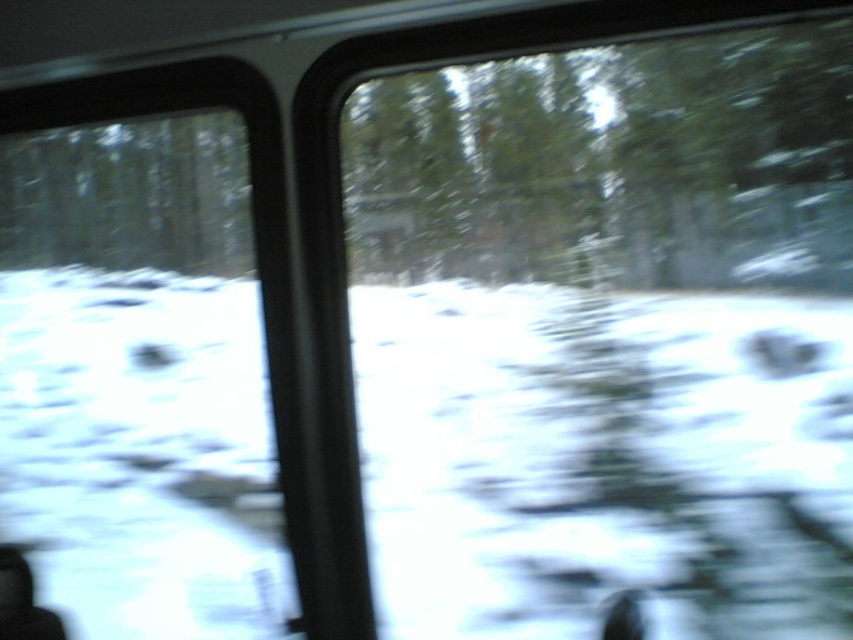
You are a passenger in a moving car and notice two green matte trees outside the window. The trees are labeled as the green matte tree at upper center and the green matte tree at upper left. Which of these two trees appears wider from your viewpoint inside the car?

The green matte tree at upper center appears wider than the green matte tree at upper left because its width is larger according to the description.

Based on the photo, you are sitting in the vehicle and want to reach the point marked at coordinates (541, 93) outside the window. If your arm can extend 1.8 meters, can you reach that point?

The point marked at coordinates (541, 93) is 1.91 meters away from the viewer. Since your arm can only extend 1.8 meters, you cannot reach that point.

You are a passenger in a moving car and notice two green matte trees outside the window. The trees are labeled as the green matte tree at upper center and the green matte tree at upper left. From your perspective inside the car, which tree is located to the right of the other?

The green matte tree at upper center is positioned on the right side of the green matte tree at upper left, so from your perspective inside the car, the green matte tree at upper center is to the right of the green matte tree at upper left.